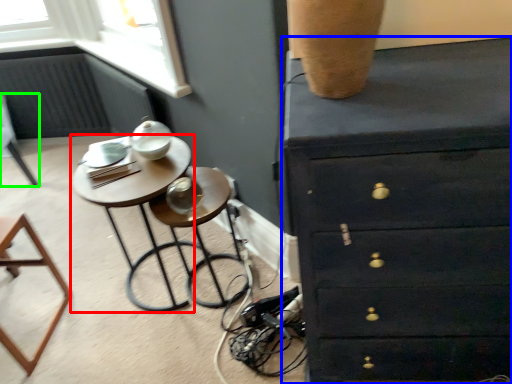
Question: Which object is positioned farthest from table (highlighted by a red box)? Select from chest of drawers (highlighted by a blue box) and furniture (highlighted by a green box).

Choices:
 (A) chest of drawers
 (B) furniture

Answer: (B)